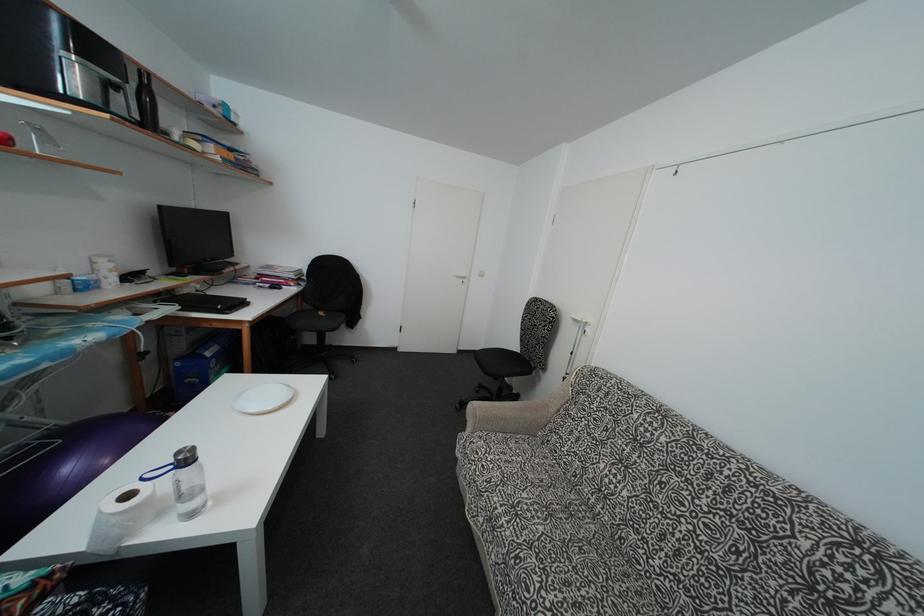
The width and height of the screenshot is (924, 616). Identify the location of closed black laptop. (205, 302).